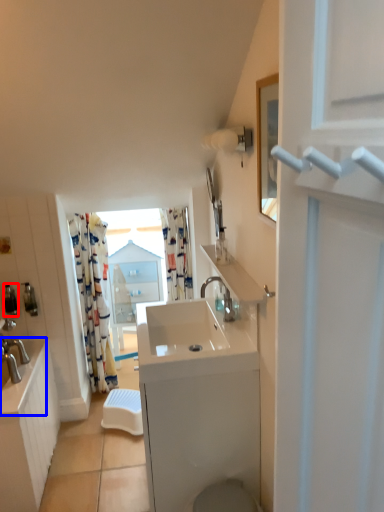
Question: Which point is closer to the camera, toiletry (highlighted by a red box) or counter top (highlighted by a blue box)?

Choices:
 (A) toiletry
 (B) counter top

Answer: (B)